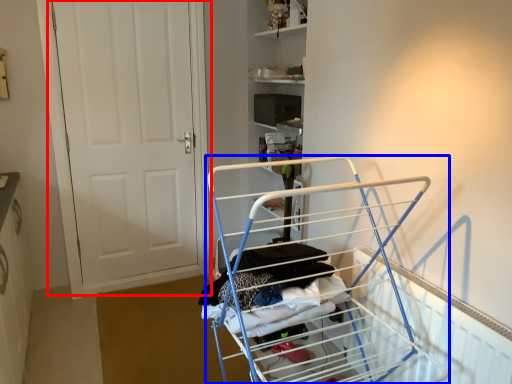
Question: Among these objects, which one is farthest to the camera, door (highlighted by a red box) or furniture (highlighted by a blue box)?

Choices:
 (A) door
 (B) furniture

Answer: (A)